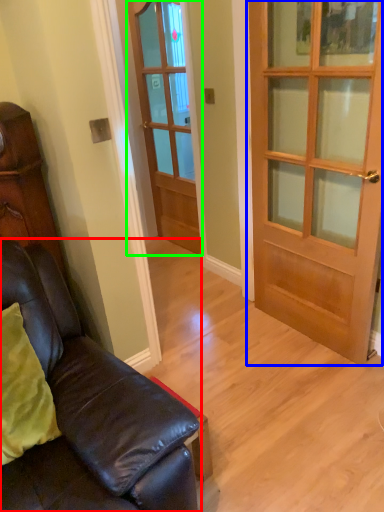
Question: Estimate the real-world distances between objects in this image. Which object is closer to studio couch (highlighted by a red box), door (highlighted by a blue box) or door (highlighted by a green box)?

Choices:
 (A) door
 (B) door

Answer: (A)